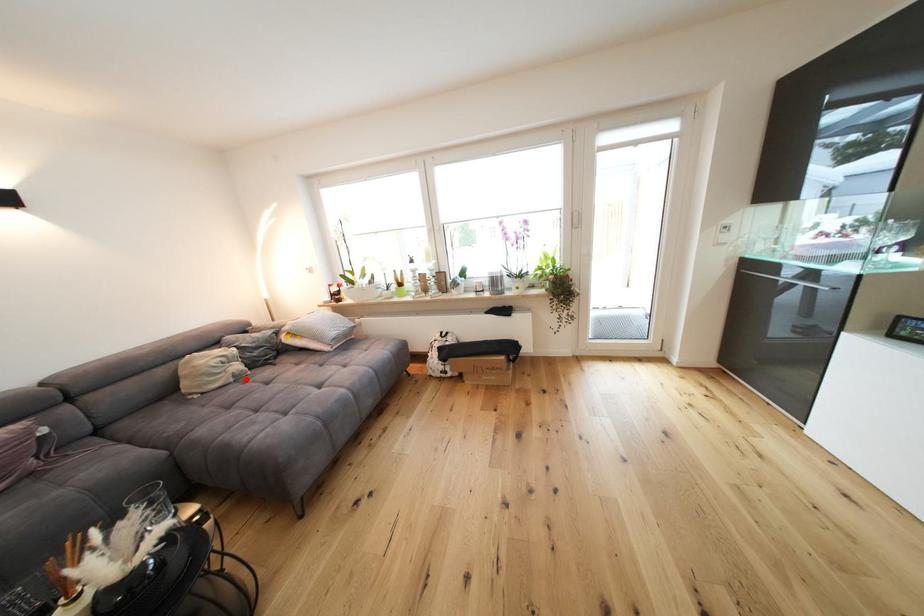
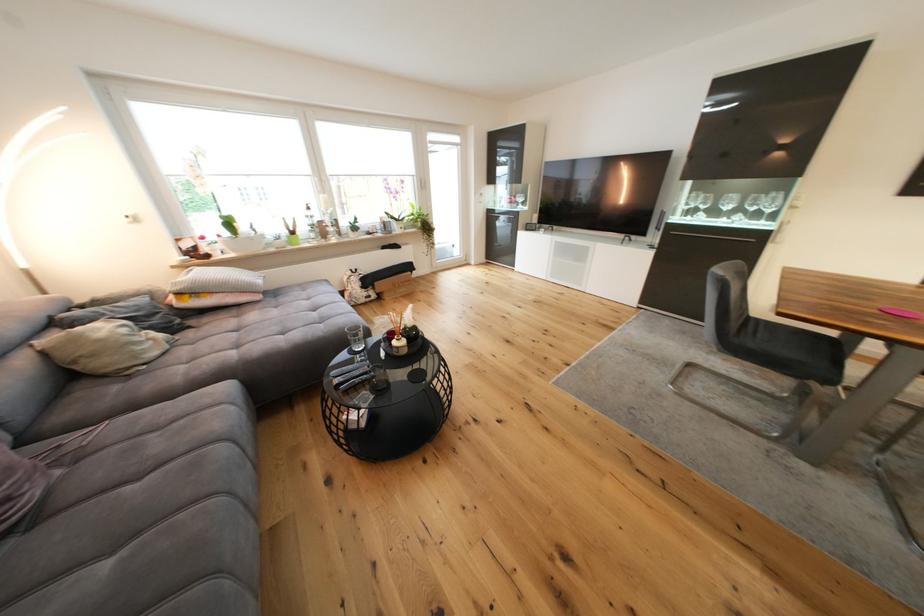
Where in the second image is the point corresponding to the highlighted location from the first image?

(178, 345)